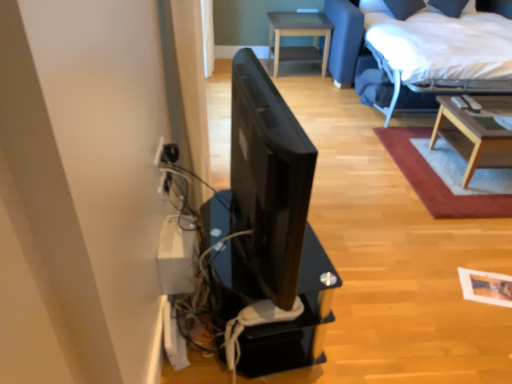
Question: Is light brown wooden table at upper center, placed as the second table when sorted from bottom to top, far away from wooden coffee table at upper right?

Choices:
 (A) no
 (B) yes

Answer: (B)

Question: Is wooden coffee table at upper right a part of light brown wooden table at upper center, the 2th table when ordered from front to back?

Choices:
 (A) yes
 (B) no

Answer: (B)

Question: Is light brown wooden table at upper center, marked as the second table in a right-to-left arrangement, in front of wooden coffee table at upper right?

Choices:
 (A) no
 (B) yes

Answer: (A)

Question: Is light brown wooden table at upper center, marked as the second table in a right-to-left arrangement, thinner than wooden coffee table at upper right?

Choices:
 (A) no
 (B) yes

Answer: (B)

Question: Is light brown wooden table at upper center, the 1th table from the back, bigger than wooden coffee table at upper right?

Choices:
 (A) no
 (B) yes

Answer: (B)

Question: Is white fabric bed at upper right situated inside light brown wooden table at upper center, placed as the second table when sorted from bottom to top, or outside?

Choices:
 (A) inside
 (B) outside

Answer: (B)

Question: Is point (413, 79) closer or farther from the camera than point (278, 59)?

Choices:
 (A) farther
 (B) closer

Answer: (B)

Question: Based on their sizes in the image, would you say white fabric bed at upper right is bigger or smaller than light brown wooden table at upper center, the 1th table from the back?

Choices:
 (A) small
 (B) big

Answer: (B)

Question: In the image, is white fabric bed at upper right on the left side or the right side of light brown wooden table at upper center, the first table from the left?

Choices:
 (A) right
 (B) left

Answer: (A)

Question: Do you think black glossy monitor at center is within light brown wooden table at upper center, marked as the second table in a right-to-left arrangement, or outside of it?

Choices:
 (A) outside
 (B) inside

Answer: (A)

Question: Does point pyautogui.click(x=286, y=162) appear closer or farther from the camera than point pyautogui.click(x=301, y=54)?

Choices:
 (A) farther
 (B) closer

Answer: (B)

Question: From the image's perspective, is black glossy monitor at center above or below light brown wooden table at upper center, placed as the second table when sorted from bottom to top?

Choices:
 (A) above
 (B) below

Answer: (B)

Question: Is black glossy monitor at center wider or thinner than light brown wooden table at upper center, which is the first table from top to bottom?

Choices:
 (A) thin
 (B) wide

Answer: (A)

Question: Considering the positions of white fabric bed at upper right and black glossy monitor at center in the image, is white fabric bed at upper right taller or shorter than black glossy monitor at center?

Choices:
 (A) tall
 (B) short

Answer: (A)

Question: In the image, is white fabric bed at upper right positioned in front of or behind black glossy monitor at center?

Choices:
 (A) behind
 (B) front

Answer: (A)